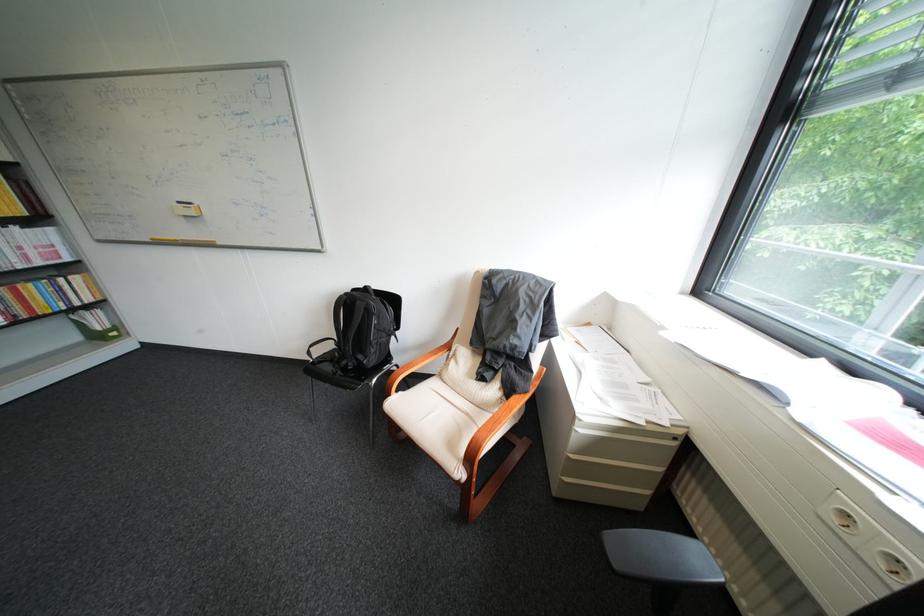
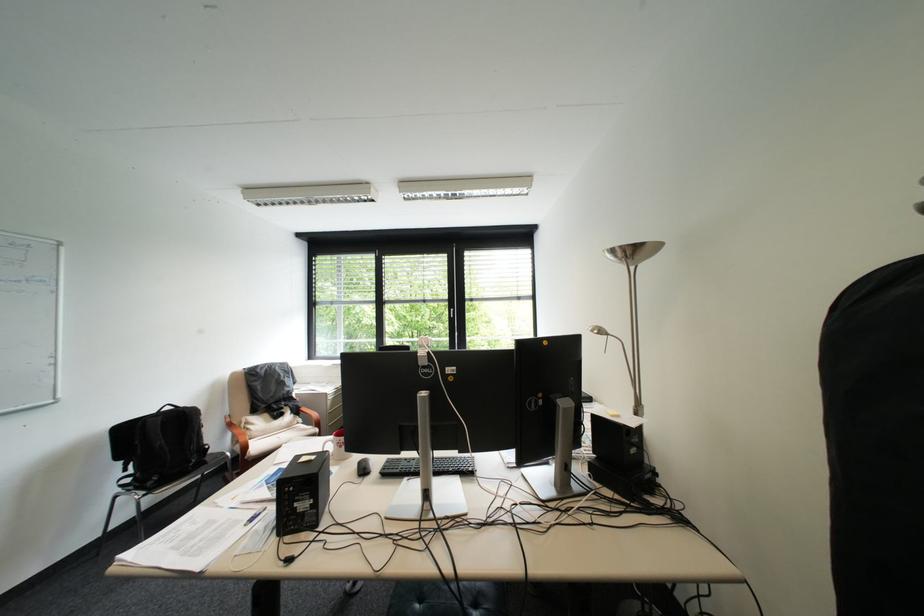
Where in the second image is the point corresponding to point 370,302 from the first image?

(198, 411)